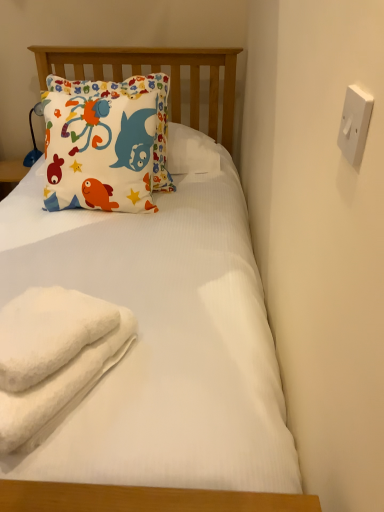
Question: Is matte cotton pillow at upper left smaller than white fluffy towel at lower left?

Choices:
 (A) yes
 (B) no

Answer: (B)

Question: Does matte cotton pillow at upper left have a larger size compared to white fluffy towel at lower left?

Choices:
 (A) yes
 (B) no

Answer: (A)

Question: Are matte cotton pillow at upper left and white fluffy towel at lower left beside each other?

Choices:
 (A) yes
 (B) no

Answer: (B)

Question: Is matte cotton pillow at upper left positioned beyond the bounds of white fluffy towel at lower left?

Choices:
 (A) yes
 (B) no

Answer: (A)

Question: Is white fluffy towel at lower left a part of matte cotton pillow at upper left?

Choices:
 (A) no
 (B) yes

Answer: (A)

Question: From the image's perspective, does matte cotton pillow at upper left appear lower than white fluffy towel at lower left?

Choices:
 (A) no
 (B) yes

Answer: (A)

Question: Would you say white fluffy towel at lower left is part of white fluffy beach towel at lower left's contents?

Choices:
 (A) no
 (B) yes

Answer: (B)

Question: Considering the relative sizes of white fluffy beach towel at lower left and white fluffy towel at lower left in the image provided, is white fluffy beach towel at lower left taller than white fluffy towel at lower left?

Choices:
 (A) no
 (B) yes

Answer: (B)

Question: From a real-world perspective, is white fluffy beach towel at lower left over white fluffy towel at lower left?

Choices:
 (A) yes
 (B) no

Answer: (B)

Question: Is white fluffy beach towel at lower left thinner than white fluffy towel at lower left?

Choices:
 (A) yes
 (B) no

Answer: (B)

Question: From the image's perspective, is white fluffy beach towel at lower left located beneath white fluffy towel at lower left?

Choices:
 (A) no
 (B) yes

Answer: (B)

Question: From the image's perspective, is white fluffy beach towel at lower left above white fluffy towel at lower left?

Choices:
 (A) yes
 (B) no

Answer: (B)

Question: Can you confirm if white fluffy towel at lower left is shorter than white fluffy beach towel at lower left?

Choices:
 (A) yes
 (B) no

Answer: (A)